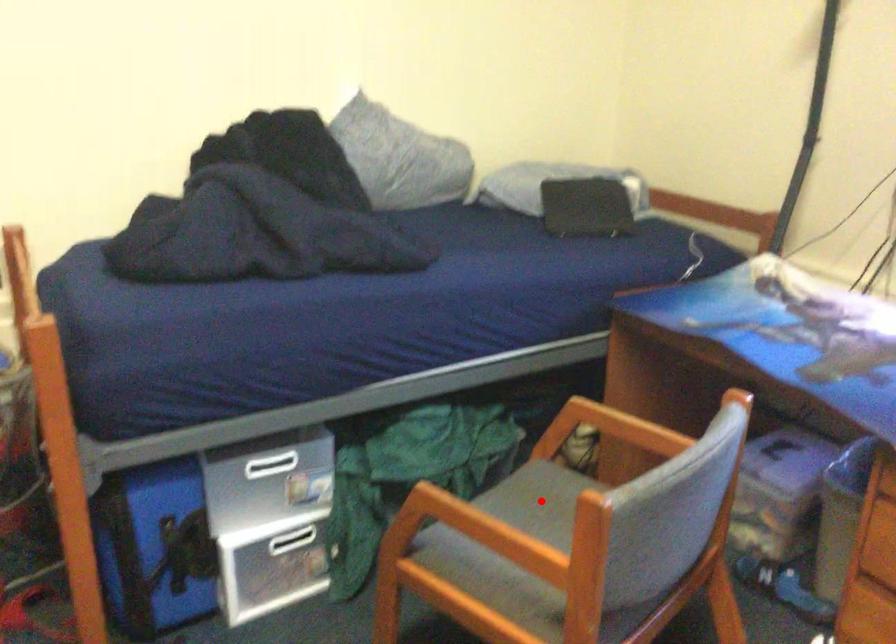
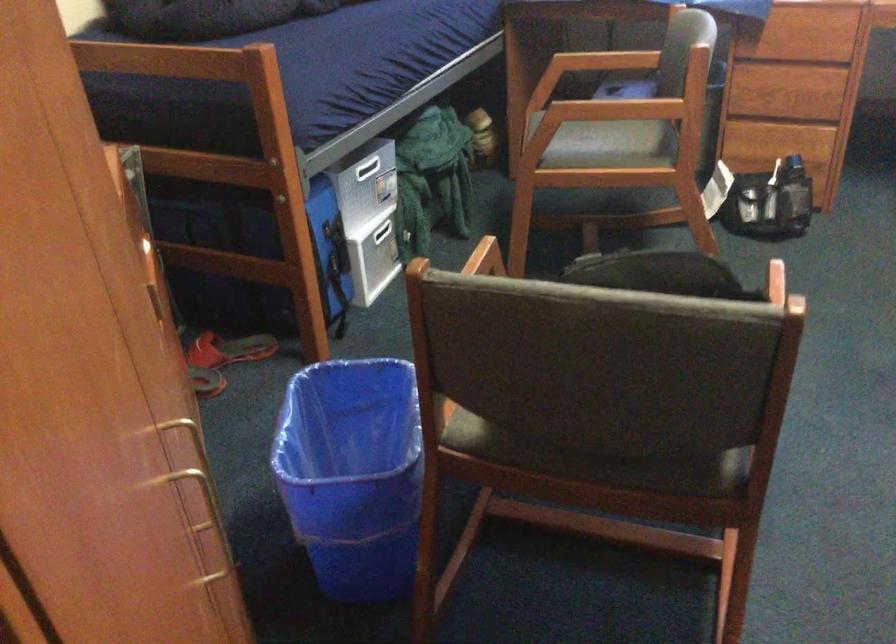
Question: I am providing you with two images of the same scene from different viewpoints. A red point is marked on the first image. Is the red point's position out of view in image 2?

Choices:
 (A) Yes
 (B) No

Answer: (A)